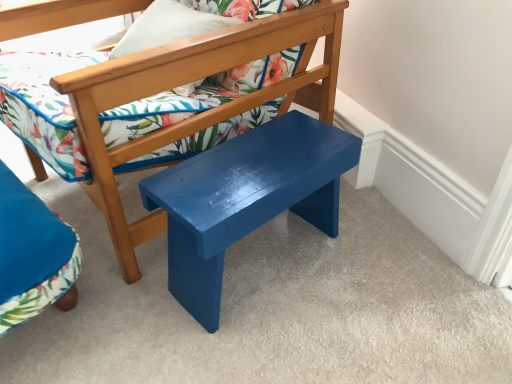
Question: Is matte blue bench at center, which is counted as the 1th chair, starting from the top, far from matte floral pillow at upper center?

Choices:
 (A) yes
 (B) no

Answer: (B)

Question: Is matte blue bench at center, which is counted as the 1th chair, starting from the top, outside of matte floral pillow at upper center?

Choices:
 (A) no
 (B) yes

Answer: (B)

Question: Considering the relative positions of matte blue bench at center, which is counted as the 1th chair, starting from the top, and matte floral pillow at upper center in the image provided, is matte blue bench at center, which is counted as the 1th chair, starting from the top, behind matte floral pillow at upper center?

Choices:
 (A) no
 (B) yes

Answer: (A)

Question: Is matte blue bench at center, arranged as the 2th chair when ordered from the bottom, thinner than matte floral pillow at upper center?

Choices:
 (A) yes
 (B) no

Answer: (B)

Question: Is matte blue bench at center, arranged as the 2th chair when ordered from the bottom, oriented towards matte floral pillow at upper center?

Choices:
 (A) no
 (B) yes

Answer: (B)

Question: From a real-world perspective, is matte blue bench at center, arranged as the 2th chair when ordered from the bottom, physically located above or below velvet blue chair at lower left, which appears as the 1th chair when ordered from the bottom?

Choices:
 (A) above
 (B) below

Answer: (A)

Question: In terms of height, does matte blue bench at center, which is counted as the 1th chair, starting from the top, look taller or shorter compared to velvet blue chair at lower left, placed as the 2th chair when sorted from top to bottom?

Choices:
 (A) short
 (B) tall

Answer: (B)

Question: Looking at the image, does matte blue bench at center, which is counted as the 1th chair, starting from the top, seem bigger or smaller compared to velvet blue chair at lower left, which appears as the 1th chair when ordered from the bottom?

Choices:
 (A) big
 (B) small

Answer: (A)

Question: Looking at their shapes, would you say matte blue bench at center, which is counted as the 1th chair, starting from the top, is wider or thinner than velvet blue chair at lower left, which appears as the 1th chair when ordered from the bottom?

Choices:
 (A) thin
 (B) wide

Answer: (B)

Question: Based on their sizes in the image, would you say matte floral pillow at upper center is bigger or smaller than matte blue bench at center, arranged as the 2th chair when ordered from the bottom?

Choices:
 (A) small
 (B) big

Answer: (A)

Question: From their relative heights in the image, would you say matte floral pillow at upper center is taller or shorter than matte blue bench at center, arranged as the 2th chair when ordered from the bottom?

Choices:
 (A) short
 (B) tall

Answer: (A)

Question: Is matte floral pillow at upper center inside or outside of matte blue bench at center, which is counted as the 1th chair, starting from the top?

Choices:
 (A) outside
 (B) inside

Answer: (B)

Question: Is point 168,18 positioned closer to the camera than point 147,218?

Choices:
 (A) closer
 (B) farther

Answer: (B)

Question: In terms of height, does matte floral pillow at upper center look taller or shorter compared to velvet blue chair at lower left, which appears as the 1th chair when ordered from the bottom?

Choices:
 (A) short
 (B) tall

Answer: (B)

Question: Does point (155, 46) appear closer or farther from the camera than point (51, 268)?

Choices:
 (A) farther
 (B) closer

Answer: (A)